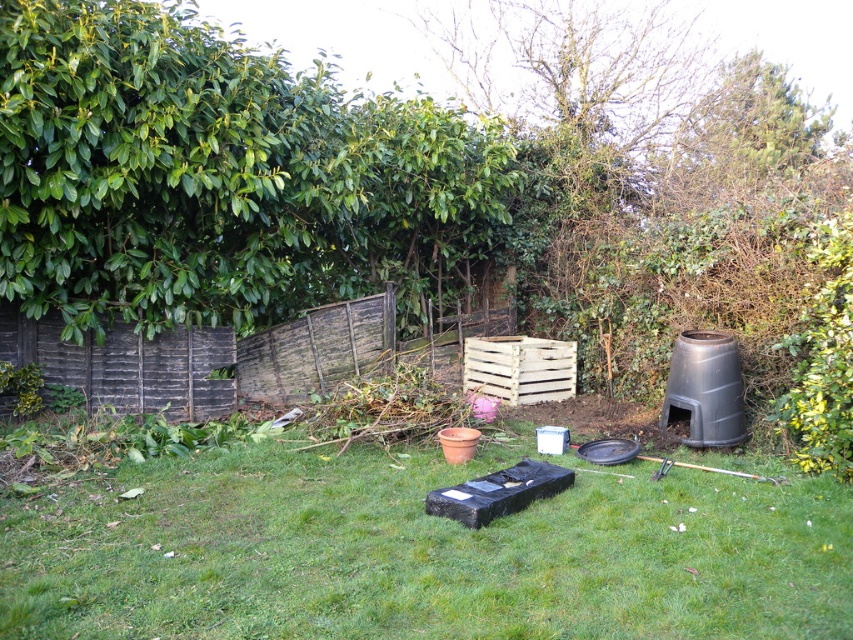
Is point (598, 490) positioned behind point (36, 323)?

That is False.

Who is taller, green grass at center or weathered wood fence at center?

With more height is weathered wood fence at center.

Identify the location of green grass at center. This screenshot has width=853, height=640. (424, 550).

Find the location of a particular element. green grass at center is located at coordinates (424, 550).

Does weathered wood fence at center have a greater width compared to white wooden crate at center?

Correct, the width of weathered wood fence at center exceeds that of white wooden crate at center.

Is weathered wood fence at center smaller than white wooden crate at center?

No.

Does point (161, 372) come closer to viewer compared to point (483, 344)?

That is True.

Locate an element on the screen. weathered wood fence at center is located at coordinates (207, 358).

From the picture: Is green grass at center wider than white wooden crate at center?

Yes, green grass at center is wider than white wooden crate at center.

Can you confirm if green grass at center is thinner than white wooden crate at center?

In fact, green grass at center might be wider than white wooden crate at center.

Find the location of a particular element. The image size is (853, 640). green grass at center is located at coordinates (424, 550).

At what (x,y) coordinates should I click in order to perform the action: click on green grass at center. Please return your answer as a coordinate pair (x, y). This screenshot has height=640, width=853. Looking at the image, I should click on (424, 550).